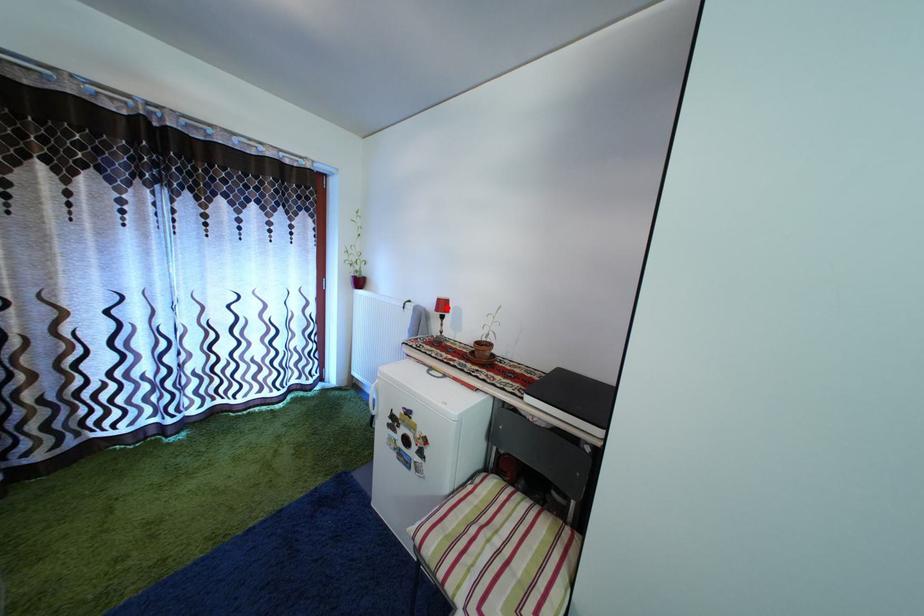
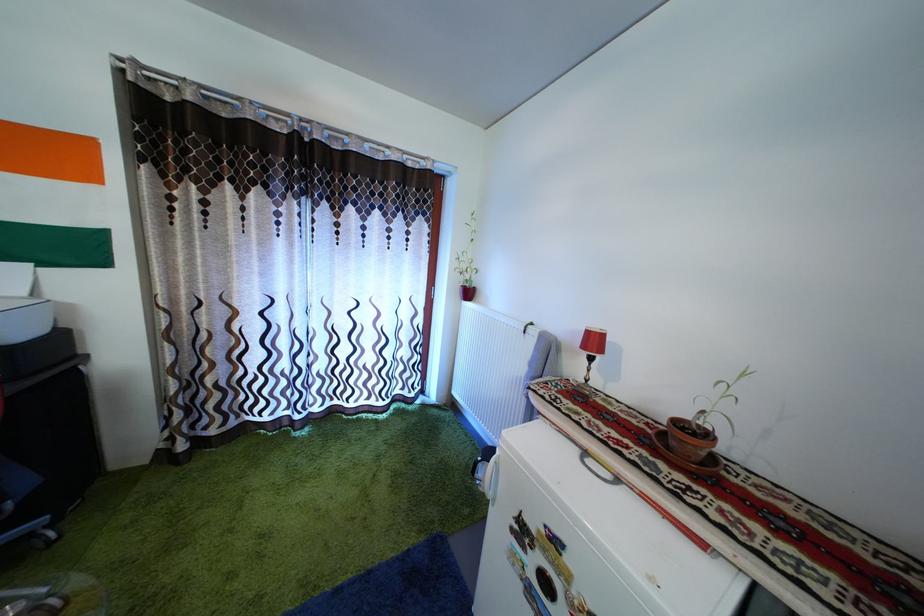
The point at the highlighted location is marked in the first image. Where is the corresponding point in the second image?

(598, 339)